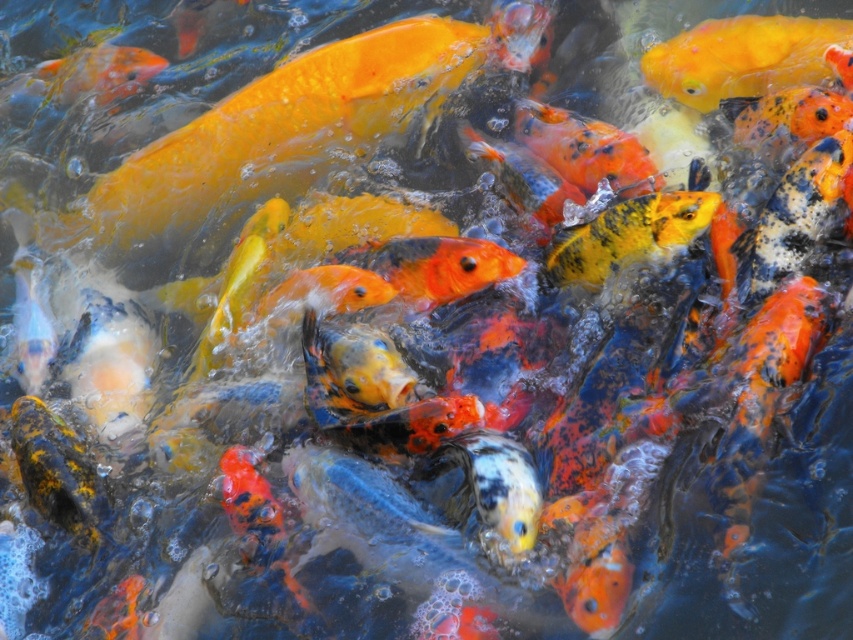
Question: Is shiny orange fish at upper right behind yellow speckled fish at center?

Choices:
 (A) no
 (B) yes

Answer: (B)

Question: Among these objects, which one is farthest from the camera?

Choices:
 (A) shiny orange fish at upper right
 (B) orange glossy fish at upper left
 (C) yellow speckled fish at center

Answer: (B)

Question: Which object is farther from the camera taking this photo?

Choices:
 (A) orange glossy fish at upper left
 (B) yellow speckled fish at center
 (C) shiny orange fish at upper right

Answer: (A)

Question: Is shiny orange fish at upper right bigger than yellow speckled fish at center?

Choices:
 (A) yes
 (B) no

Answer: (A)

Question: Does shiny orange fish at upper right have a greater width compared to yellow speckled fish at center?

Choices:
 (A) no
 (B) yes

Answer: (B)

Question: Which point is farther to the camera?

Choices:
 (A) (149, 76)
 (B) (602, 253)

Answer: (A)